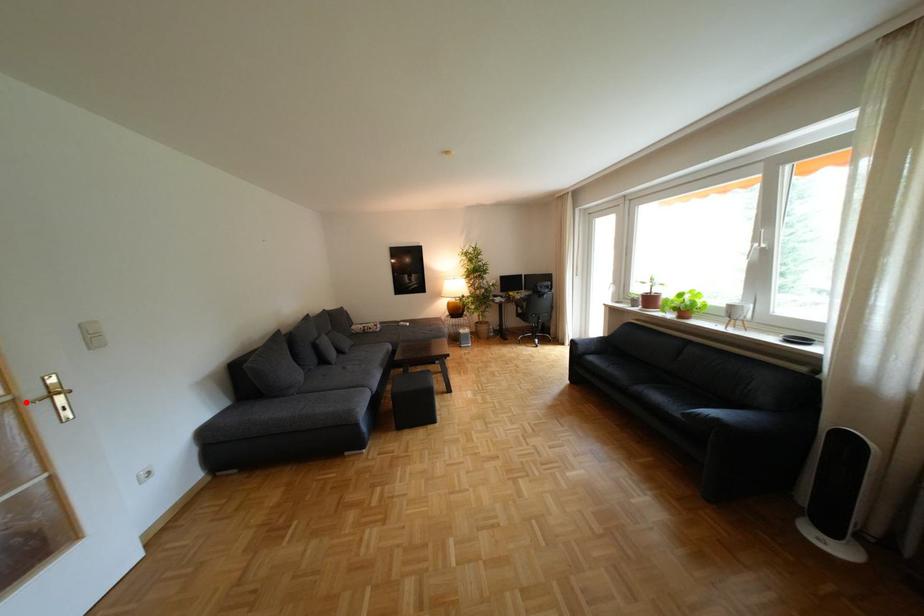
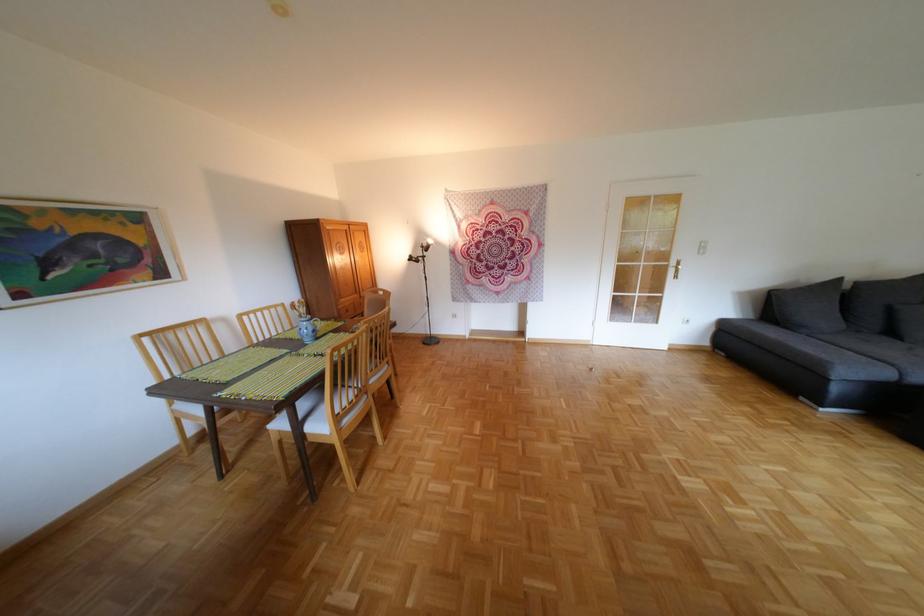
The point at the highlighted location is marked in the first image. Where is the corresponding point in the second image?

(679, 265)